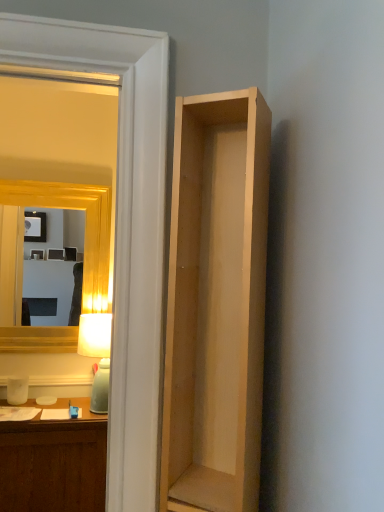
Question: From the image's perspective, relative to matte white lamp at left, is transparent glass door at upper left above or below?

Choices:
 (A) above
 (B) below

Answer: (A)

Question: Considering the positions of transparent glass door at upper left and matte white lamp at left in the image, is transparent glass door at upper left bigger or smaller than matte white lamp at left?

Choices:
 (A) big
 (B) small

Answer: (A)

Question: Which object is the farthest from the gold wooden mirror at upper left?

Choices:
 (A) matte white lamp at left
 (B) transparent glass door at upper left
 (C) natural wood shelf at right

Answer: (C)

Question: Which object is positioned closest to the natural wood shelf at right?

Choices:
 (A) gold wooden mirror at upper left
 (B) matte white lamp at left
 (C) transparent glass door at upper left

Answer: (C)